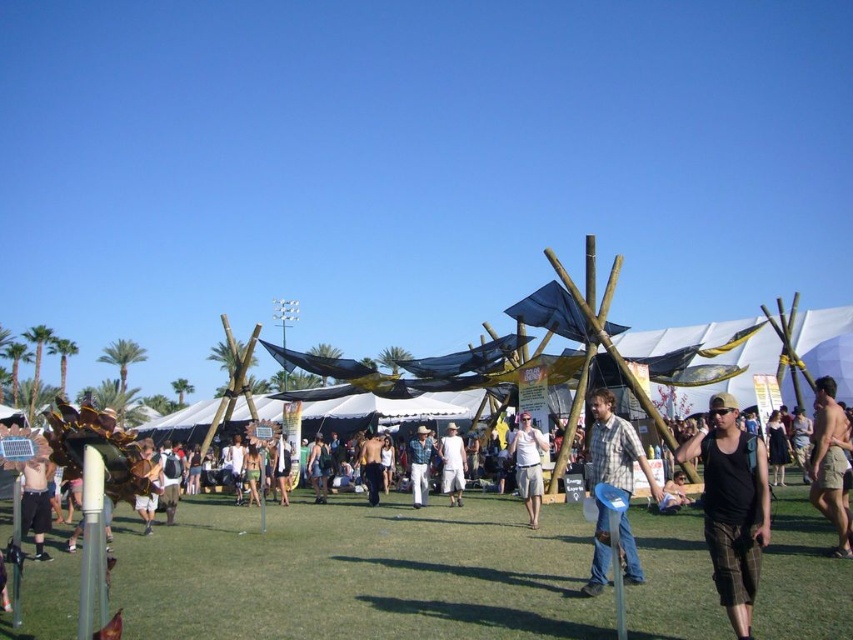
Is denim pants at center wider than skinny shirtless man at center?

In fact, denim pants at center might be narrower than skinny shirtless man at center.

Is the position of denim pants at center more distant than that of skinny shirtless man at center?

No, denim pants at center is in front of skinny shirtless man at center.

You are a GUI agent. You are given a task and a screenshot of the screen. Output one action in this format:
    pyautogui.click(x=<x>, y=<y>)
    Task: Click on the denim pants at center
    The image size is (853, 640).
    Given the screenshot: What is the action you would take?
    pyautogui.click(x=419, y=465)

Does tan shorts at lower right come behind white cotton shorts at center?

No, tan shorts at lower right is in front of white cotton shorts at center.

Looking at this image, does tan shorts at lower right have a lesser width compared to white cotton shorts at center?

In fact, tan shorts at lower right might be wider than white cotton shorts at center.

Is point (817, 506) positioned in front of point (451, 436)?

Yes, it is in front of point (451, 436).

Locate an element on the screen. The width and height of the screenshot is (853, 640). tan shorts at lower right is located at coordinates (830, 461).

Does black shorts at lower left appear under denim pants at center?

No, black shorts at lower left is not below denim pants at center.

From the picture: Between black shorts at lower left and denim pants at center, which one has less height?

With less height is denim pants at center.

Does point (28, 486) come in front of point (421, 456)?

Yes, point (28, 486) is closer to viewer.

Where is `black shorts at lower left`? This screenshot has width=853, height=640. black shorts at lower left is located at coordinates (36, 504).